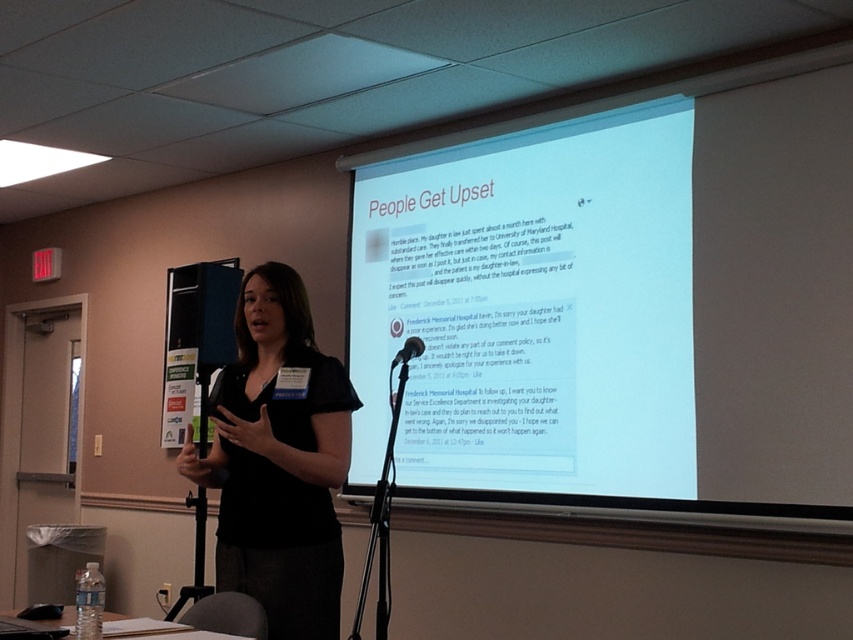
You are a stagehand who needs to adjust the microphone stand so that the black matte microphone at center is closer to the black matte shirt at center. How much closer should you move the microphone stand in inches?

The black matte shirt at center and black matte microphone at center are currently 29.41 inches apart. To move the microphone closer, you should adjust the stand to reduce this distance. The exact amount depends on desired proximity, but moving it by 5 inches would bring them to 24.41 inches apart, which is closer.

You are an attendee at the presentation and want to see both the white matte projector screen at upper center and the black matte shirt at center. Which one is higher in the image?

The white matte projector screen at upper center is higher than the black matte shirt at center because it is positioned over it.

You are a technician who needs to set up a camera to capture the presenter and the screen. The camera has a minimum focus distance of 3 meters. According to the scene description, can the camera be placed at the back of the room to capture both the presenter and the white matte projector screen at upper center without moving it?

The white matte projector screen at upper center and camera are 3.22 meters apart, which is just over the camera minimum focus distance of 3 meters. Therefore, the camera can be placed at the back of the room to capture both the presenter and the white matte projector screen at upper center without moving it.